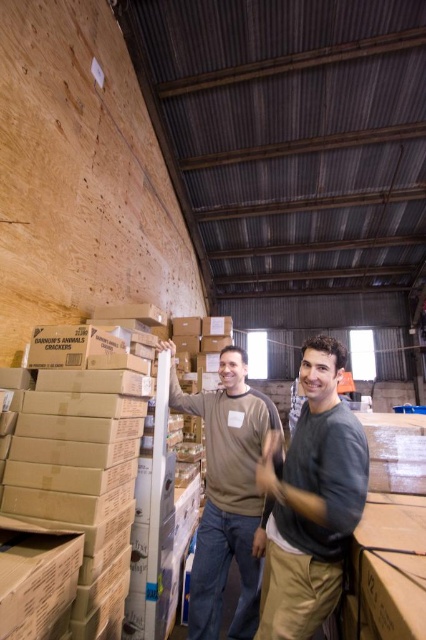
From the picture: You are navigating through the warehouse and need to reach a specific location. There are two points marked in the image. Which point is closer to you, point (360,442) or point (239,436)?

Point (360,442) is in front of point (239,436), so it is closer to you.

You are a warehouse worker who needs to move a box from the dark gray cotton shirt at center to the brown cotton shirt at center. Can you hand it directly without needing to move more than 1 foot?

The distance between the dark gray cotton shirt at center and the brown cotton shirt at center is 12.88 inches, which is just over 1 foot. Therefore, you would need to move more than 1 foot to hand it directly.

You are a warehouse inspector checking the height of two workers. You see a dark gray cotton shirt at center and a brown cotton shirt at center. Which worker is shorter?

The dark gray cotton shirt at center is shorter than the brown cotton shirt at center, so the worker wearing the dark gray cotton shirt at center is shorter.